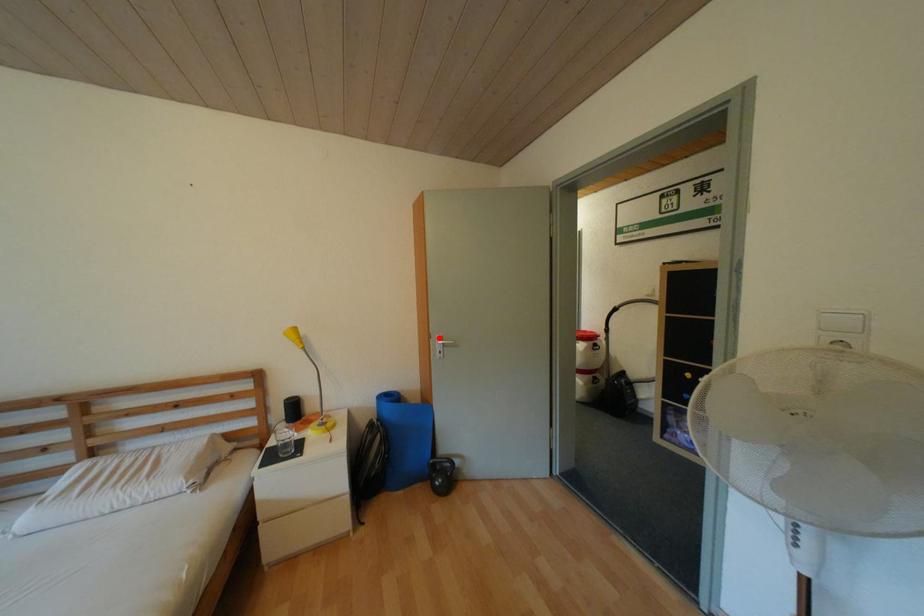
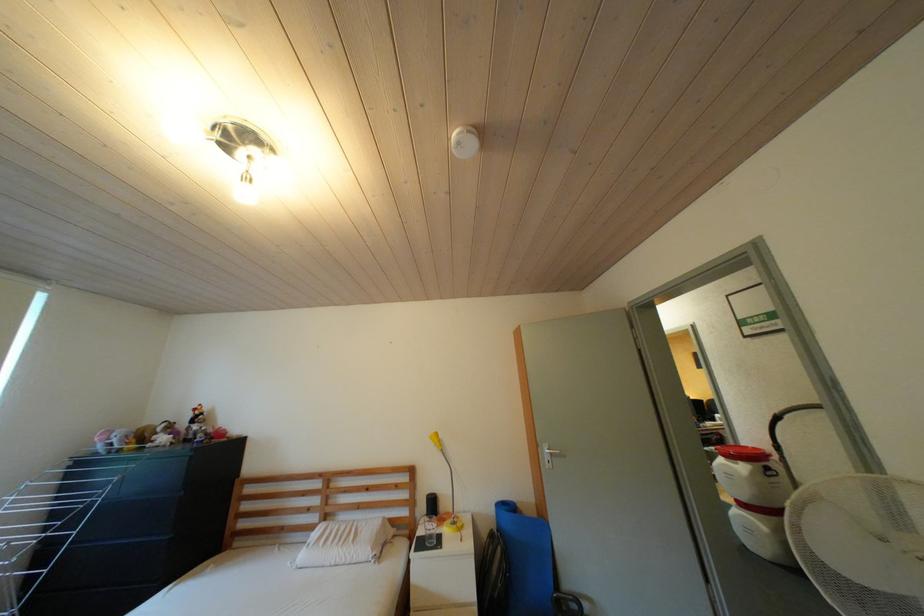
Question: I am providing you with two images of the same scene from different viewpoints. A red point is shown in image1. For the corresponding object point in image2, is it positioned nearer or farther from the camera?

Choices:
 (A) Nearer
 (B) Farther

Answer: (B)